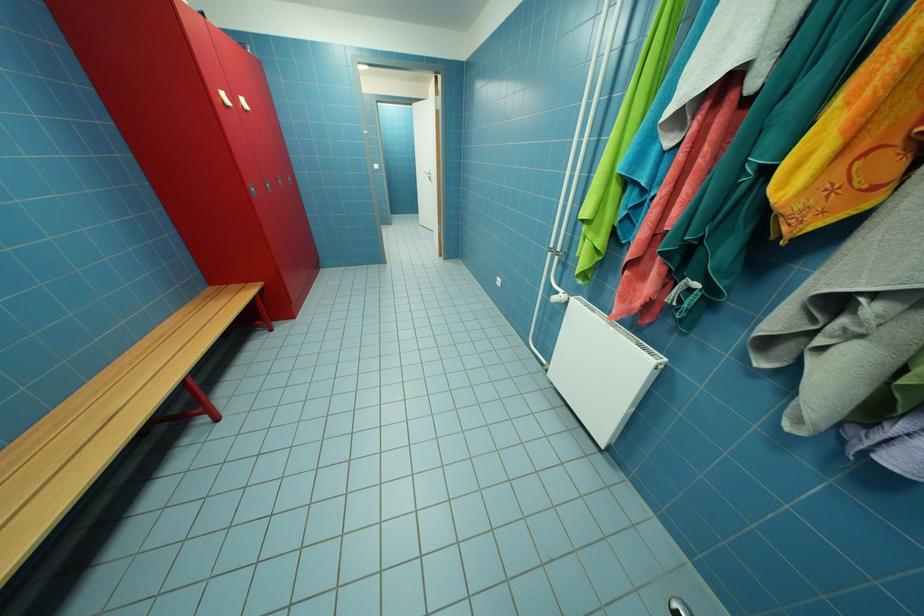
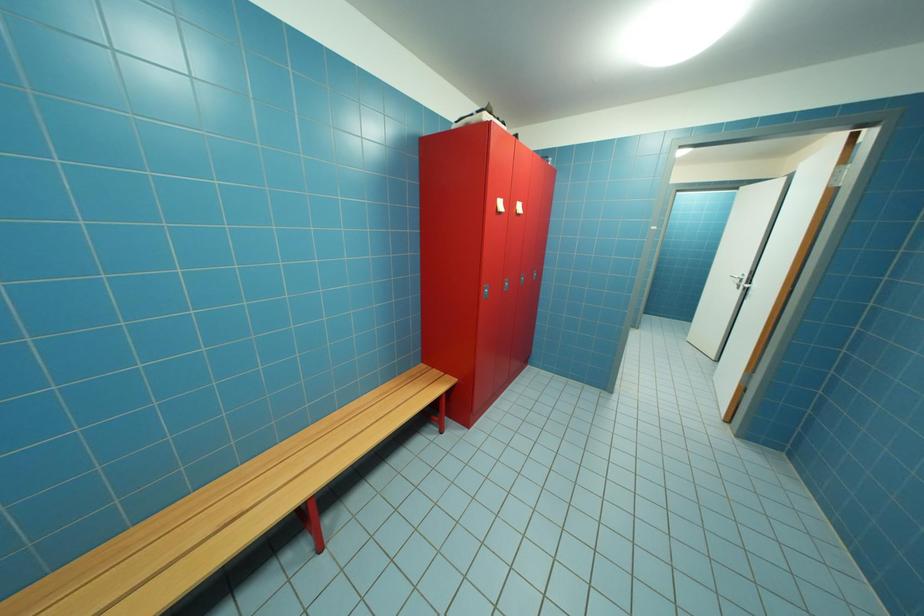
Question: The camera is either moving clockwise (left) or counter-clockwise (right) around the object. The first image is from the beginning of the video and the second image is from the end. Is the camera moving left or right when shooting the video?

Choices:
 (A) Left
 (B) Right

Answer: (B)